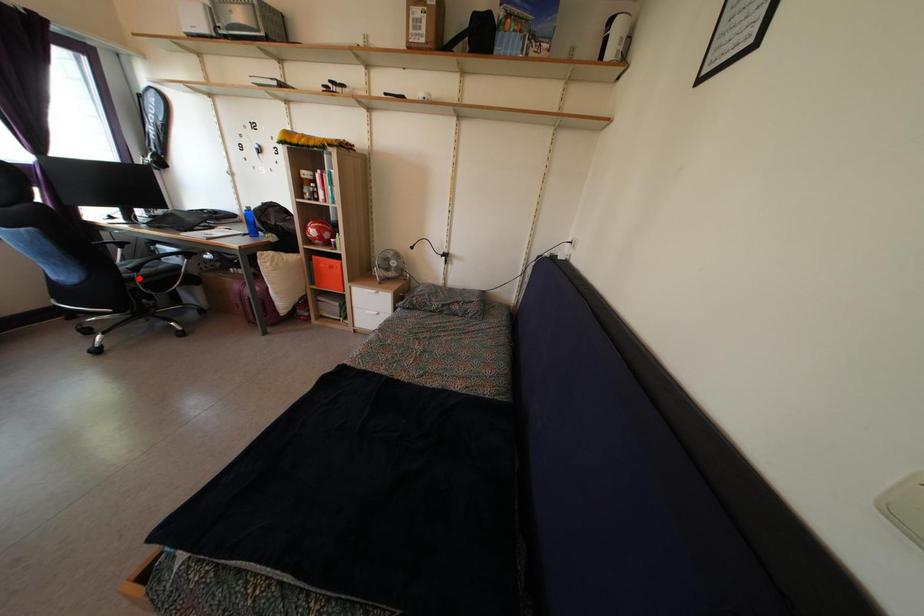
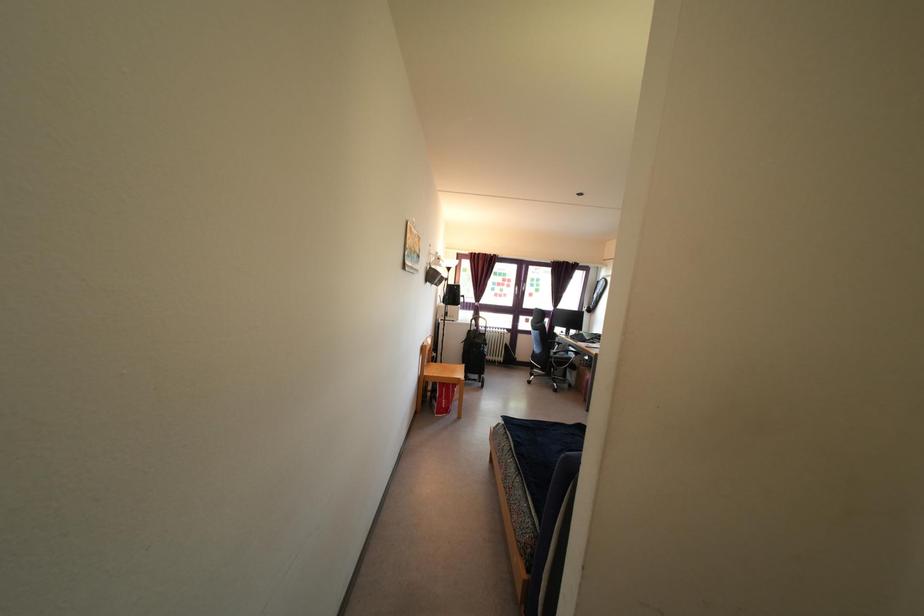
Question: I am providing you with two images of the same scene from different viewpoints. A red point is marked on the first image. At the location where the point appears in image 1, is it still visible in image 2?

Choices:
 (A) Yes
 (B) No

Answer: (A)